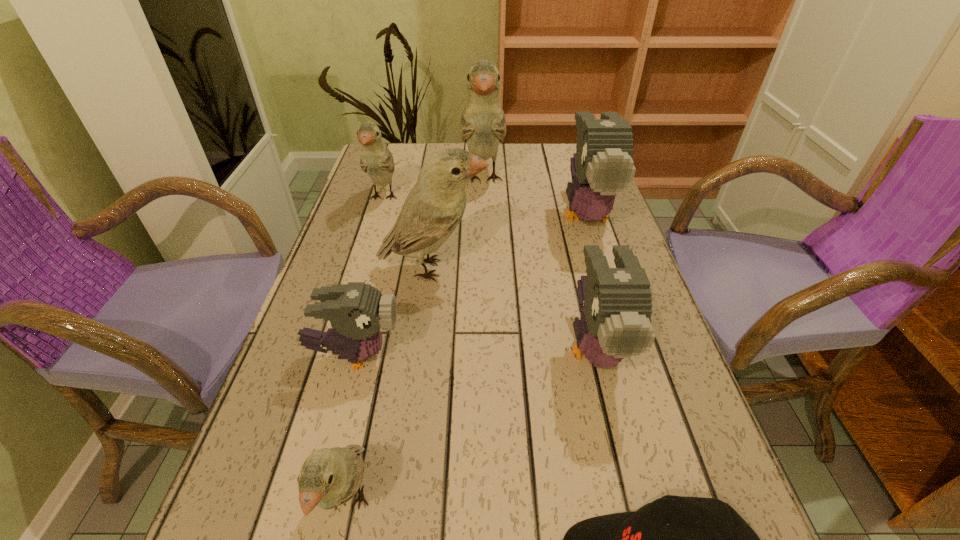
Where is `free space that satisfies the following two spatial constraints: 1. at the face of the tallest object; 2. at the face of the fourth nearest bird`? The image size is (960, 540). free space that satisfies the following two spatial constraints: 1. at the face of the tallest object; 2. at the face of the fourth nearest bird is located at coordinates (484, 268).

At what (x,y) coordinates should I click in order to perform the action: click on vacant region that satisfies the following two spatial constraints: 1. at the beak of the second smallest gray bird; 2. at the beak of the leftmost gray bird. Please return your answer as a coordinate pair (x, y). This screenshot has width=960, height=540. Looking at the image, I should click on (596, 356).

Locate an element on the screen. The image size is (960, 540). vacant space that satisfies the following two spatial constraints: 1. at the beak of the biggest gray bird; 2. at the face of the second biggest white bird is located at coordinates (602, 268).